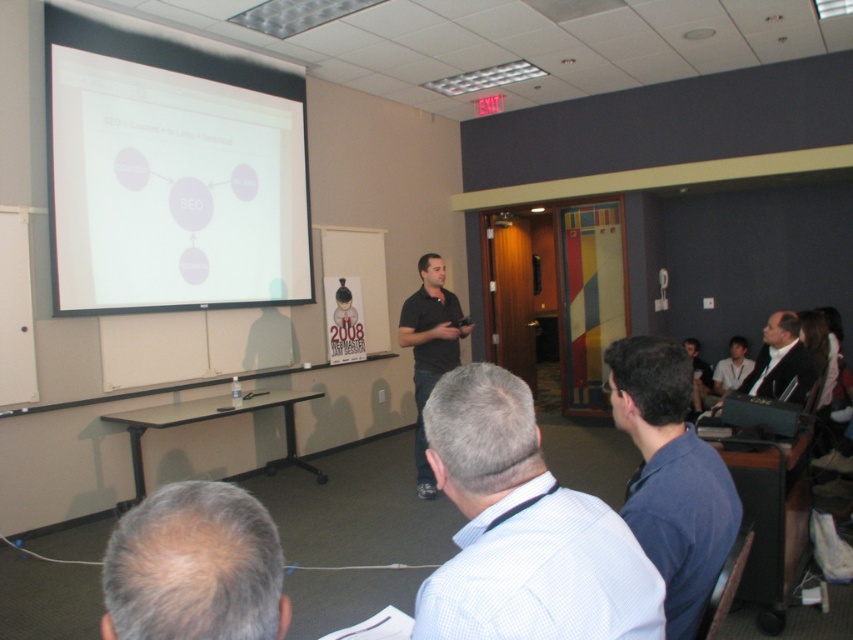
Question: Can you confirm if blue shirt at lower right is bigger than black plastic projector at upper left?

Choices:
 (A) yes
 (B) no

Answer: (A)

Question: Which is nearer to the gray hair at center?

Choices:
 (A) blue shirt at lower right
 (B) white matte projection screen at upper left
 (C) black shirt at center

Answer: (A)

Question: Is gray hair at center further to camera compared to dark suit jacket at upper right?

Choices:
 (A) no
 (B) yes

Answer: (A)

Question: From the image, what is the correct spatial relationship of white matte projection screen at upper left in relation to gray hair at center?

Choices:
 (A) left
 (B) right

Answer: (A)

Question: Which point appears farthest from the camera in this image?

Choices:
 (A) (523, 548)
 (B) (717, 536)
 (C) (749, 410)
 (D) (109, 284)

Answer: (D)

Question: Which of the following is the closest to the observer?

Choices:
 (A) pos(732,534)
 (B) pos(457,620)

Answer: (B)